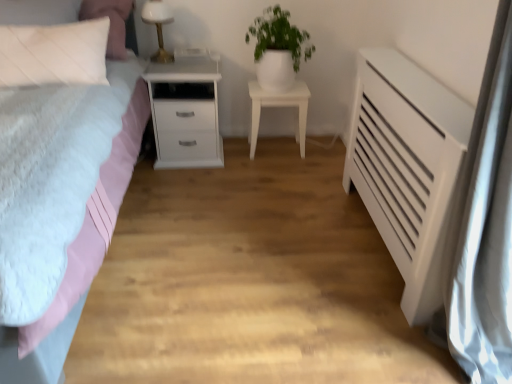
Question: From a real-world perspective, is white glossy nightstand at center, acting as the second nightstand starting from the left, physically above white glossy pot at upper center?

Choices:
 (A) yes
 (B) no

Answer: (B)

Question: Is white glossy nightstand at center, marked as the 1th nightstand in a right-to-left arrangement, bigger than white glossy pot at upper center?

Choices:
 (A) no
 (B) yes

Answer: (A)

Question: From a real-world perspective, is white glossy nightstand at center, acting as the second nightstand starting from the left, beneath white glossy pot at upper center?

Choices:
 (A) yes
 (B) no

Answer: (A)

Question: Does white glossy nightstand at center, acting as the second nightstand starting from the left, appear on the left side of white glossy pot at upper center?

Choices:
 (A) no
 (B) yes

Answer: (A)

Question: Can you confirm if white glossy nightstand at center, acting as the second nightstand starting from the left, is smaller than white glossy pot at upper center?

Choices:
 (A) no
 (B) yes

Answer: (B)

Question: Is white matte radiator at right taller or shorter than white matte nightstand at left, marked as the 1th nightstand in a left-to-right arrangement?

Choices:
 (A) tall
 (B) short

Answer: (A)

Question: Is white matte radiator at right in front of or behind white matte nightstand at left, the 2th nightstand in the right-to-left sequence, in the image?

Choices:
 (A) front
 (B) behind

Answer: (A)

Question: Looking at their shapes, would you say white matte radiator at right is wider or thinner than white matte nightstand at left, the 2th nightstand in the right-to-left sequence?

Choices:
 (A) thin
 (B) wide

Answer: (B)

Question: From the image's perspective, is white matte radiator at right above or below white matte nightstand at left, marked as the 1th nightstand in a left-to-right arrangement?

Choices:
 (A) below
 (B) above

Answer: (A)

Question: Considering the positions of matte pink bed at left and white glossy table lamp at upper center in the image, is matte pink bed at left bigger or smaller than white glossy table lamp at upper center?

Choices:
 (A) big
 (B) small

Answer: (A)

Question: From the image's perspective, is matte pink bed at left above or below white glossy table lamp at upper center?

Choices:
 (A) below
 (B) above

Answer: (A)

Question: Does point (49, 380) appear closer or farther from the camera than point (165, 4)?

Choices:
 (A) farther
 (B) closer

Answer: (B)

Question: From a real-world perspective, relative to white glossy table lamp at upper center, is matte pink bed at left vertically above or below?

Choices:
 (A) above
 (B) below

Answer: (B)

Question: Based on their sizes in the image, would you say white matte radiator at right is bigger or smaller than white glossy table lamp at upper center?

Choices:
 (A) big
 (B) small

Answer: (A)

Question: From a real-world perspective, is white matte radiator at right physically located above or below white glossy table lamp at upper center?

Choices:
 (A) above
 (B) below

Answer: (B)